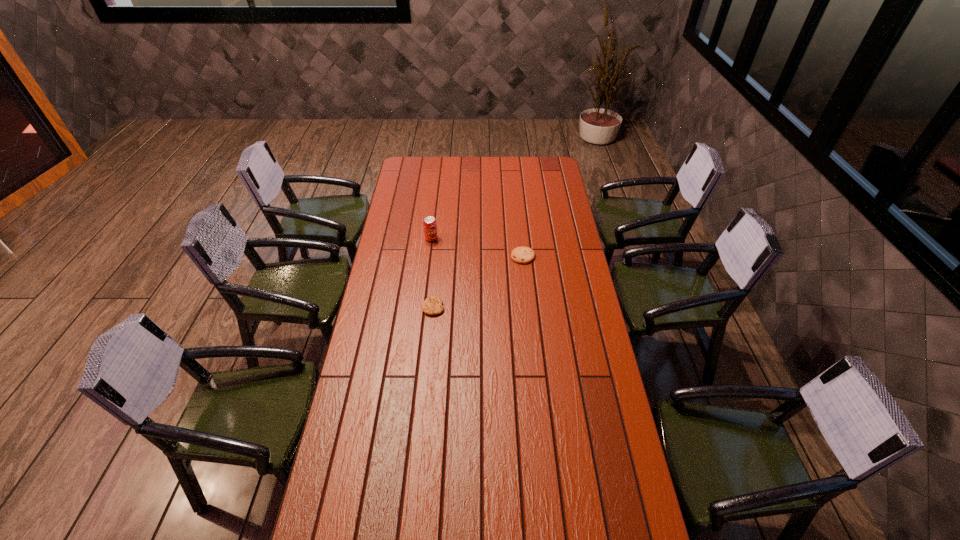
You are a GUI agent. You are given a task and a screenshot of the screen. Output one action in this format:
    pyautogui.click(x=<x>, y=<y>)
    Task: Click on the vacant space at the right edge
    The width and height of the screenshot is (960, 540).
    Given the screenshot: What is the action you would take?
    pyautogui.click(x=552, y=193)

The height and width of the screenshot is (540, 960). In the image, there is a desktop. Find the location of `vacant space at the far left corner`. vacant space at the far left corner is located at coordinates (411, 165).

Identify the location of vacant space at the far right corner of the desktop. (535, 163).

Where is `free point between the left cookie and the rightmost object`? free point between the left cookie and the rightmost object is located at coordinates pyautogui.click(x=478, y=282).

Find the location of `empty space that is in between the soda and the farther cookie`. empty space that is in between the soda and the farther cookie is located at coordinates (477, 247).

Where is `vacant region between the tallest object and the farther cookie`? This screenshot has height=540, width=960. vacant region between the tallest object and the farther cookie is located at coordinates (477, 247).

Identify the location of vacant space in between the second shortest object and the soda. point(477,247).

Where is `unoccupied position between the right cookie and the shorter cookie`? This screenshot has width=960, height=540. unoccupied position between the right cookie and the shorter cookie is located at coordinates (478, 282).

This screenshot has width=960, height=540. I want to click on empty location between the left cookie and the farther cookie, so click(x=478, y=282).

Locate an element on the screen. empty space that is in between the tallest object and the farther cookie is located at coordinates (477, 247).